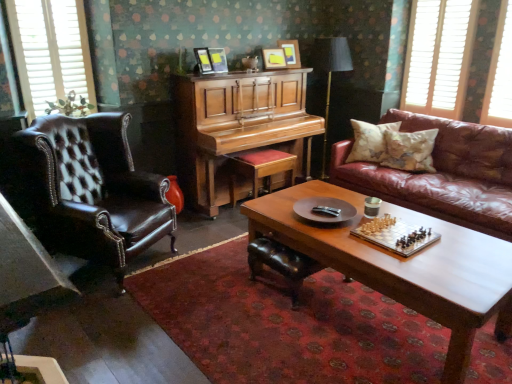
In order to face wooden picture frame at upper center, the fourth picture frame positioned from the left, should I rotate leftwards or rightwards?

To face it directly, rotate right by 4.673 degrees.

Identify the location of white wooden blinds at upper right, which is counted as the 1th window, starting from the right. (500, 74).

Measure the distance between metallic chess set at center and camera.

metallic chess set at center is 2.23 meters from camera.

Where is `wooden picture frame at upper center, the fourth picture frame positioned from the left`? This screenshot has width=512, height=384. wooden picture frame at upper center, the fourth picture frame positioned from the left is located at coordinates (291, 52).

Is polished wood piano at center situated inside matte wooden picture frame at upper center, arranged as the second picture frame when viewed from the left, or outside?

polished wood piano at center is spatially situated outside matte wooden picture frame at upper center, arranged as the second picture frame when viewed from the left.

From the picture: Is polished wood piano at center in contact with matte wooden picture frame at upper center, arranged as the second picture frame when viewed from the left?

polished wood piano at center and matte wooden picture frame at upper center, arranged as the second picture frame when viewed from the left, are clearly separated.

Identify the location of piano in front of the matte wooden picture frame at upper center, arranged as the second picture frame when viewed from the left. This screenshot has height=384, width=512. (238, 127).

Consider the image. Is polished wood piano at center turned away from matte wooden picture frame at upper center, which is counted as the 3th picture frame, starting from the right?

That's not correct — polished wood piano at center is not looking away from matte wooden picture frame at upper center, which is counted as the 3th picture frame, starting from the right.

Would you say matte wooden picture frame at upper center, which appears as the fourth picture frame when viewed from the right, is inside or outside wooden cushioned stool at center?

The correct answer is: outside.

How many degrees apart are the facing directions of matte wooden picture frame at upper center, the 1th picture frame viewed from the left, and wooden cushioned stool at center?

They differ by 164 degrees in their facing directions.

Considering the positions of points (209, 56) and (271, 176), is point (209, 56) closer to camera compared to point (271, 176)?

Yes.

Is matte wooden picture frame at upper center, the 1th picture frame viewed from the left, looking in the opposite direction of wooden cushioned stool at center?

No.

Is white wood window at upper left, which is the first window from left to right, smaller than brown leather couch at right?

Yes, white wood window at upper left, which is the first window from left to right, is smaller than brown leather couch at right.

Find the location of `studio couch below the white wood window at upper left, which is the first window from left to right (from the image's perspective)`. studio couch below the white wood window at upper left, which is the first window from left to right (from the image's perspective) is located at coordinates (443, 174).

From a real-world perspective, is white wood window at upper left, arranged as the third window when viewed from the right, located beneath brown leather couch at right?

No, from a real-world perspective, white wood window at upper left, arranged as the third window when viewed from the right, is not beneath brown leather couch at right.

Measure the distance from metallic chess set at center to white wooden blinds at upper right, acting as the 2th window starting from the left.

metallic chess set at center and white wooden blinds at upper right, acting as the 2th window starting from the left, are 7.25 feet apart from each other.

Which object is positioned more to the right, metallic chess set at center or white wooden blinds at upper right, acting as the 2th window starting from the left?

white wooden blinds at upper right, acting as the 2th window starting from the left, is more to the right.

Is metallic chess set at center next to white wooden blinds at upper right, which ranks as the second window in right-to-left order, and touching it?

metallic chess set at center and white wooden blinds at upper right, which ranks as the second window in right-to-left order, are not in contact.

How many degrees apart are the facing directions of metallic chess set at center and white wooden blinds at upper right, acting as the 2th window starting from the left?

The angle between the facing direction of metallic chess set at center and the facing direction of white wooden blinds at upper right, acting as the 2th window starting from the left, is 1.31 degrees.

Can you confirm if wooden cushioned stool at center is taller than patterned fabric pillow at right, which ranks as the 1th pillow in right-to-left order?

Yes.

Which object is positioned more to the right, wooden cushioned stool at center or patterned fabric pillow at right, marked as the 2th pillow in a left-to-right arrangement?

From the viewer's perspective, patterned fabric pillow at right, marked as the 2th pillow in a left-to-right arrangement, appears more on the right side.

Is wooden cushioned stool at center oriented towards patterned fabric pillow at right, marked as the 2th pillow in a left-to-right arrangement?

No, wooden cushioned stool at center is not aimed at patterned fabric pillow at right, marked as the 2th pillow in a left-to-right arrangement.

Does point (273, 152) appear closer or farther from the camera than point (392, 148)?

Clearly, point (273, 152) is more distant from the camera than point (392, 148).

Is wooden picture frame at upper center, which ranks as the first picture frame in right-to-left order, completely or partially inside patterned fabric pillow at right, which ranks as the 1th pillow in right-to-left order?

Definitely not — wooden picture frame at upper center, which ranks as the first picture frame in right-to-left order, is not inside patterned fabric pillow at right, which ranks as the 1th pillow in right-to-left order.

Are patterned fabric pillow at right, which ranks as the 1th pillow in right-to-left order, and wooden picture frame at upper center, the fourth picture frame positioned from the left, making contact?

patterned fabric pillow at right, which ranks as the 1th pillow in right-to-left order, and wooden picture frame at upper center, the fourth picture frame positioned from the left, are not in contact.

Does point (428, 154) lie in front of point (294, 63)?

Yes, it is in front of point (294, 63).

Which of these two, matte wooden picture frame at upper center, the third picture frame from the left, or white wood window at upper left, arranged as the third window when viewed from the right, is thinner?

Thinner between the two is white wood window at upper left, arranged as the third window when viewed from the right.

Based on the photo, which is closer to the camera, [269,60] or [65,72]?

The point [65,72] is in front.

Choose the correct answer: Is matte wooden picture frame at upper center, the third picture frame from the left, inside white wood window at upper left, arranged as the third window when viewed from the right, or outside it?

matte wooden picture frame at upper center, the third picture frame from the left, cannot be found inside white wood window at upper left, arranged as the third window when viewed from the right.

This screenshot has height=384, width=512. I want to click on the 3rd picture frame to the right of the white wood window at upper left, arranged as the third window when viewed from the right, starting your count from the anchor, so click(x=274, y=58).

Find the location of a particular element. The image size is (512, 384). piano in front of the matte wooden picture frame at upper center, arranged as the second picture frame when viewed from the left is located at coordinates (238, 127).

The image size is (512, 384). I want to click on stool that is below the matte wooden picture frame at upper center, the 1th picture frame viewed from the left (from the image's perspective), so click(259, 168).

Estimate the real-world distances between objects in this image. Which object is further from matte wooden picture frame at upper center, marked as the 2th picture frame in a right-to-left arrangement, matte black table lamp at center or wooden polished coffee table at center?

Based on the image, wooden polished coffee table at center appears to be further to matte wooden picture frame at upper center, marked as the 2th picture frame in a right-to-left arrangement.

Considering their positions, is metallic chess set at center positioned closer to patterned fabric pillow at right, marked as the 2th pillow in a left-to-right arrangement, than white wooden blinds at upper right, which is counted as the 1th window, starting from the right?

The object closer to patterned fabric pillow at right, marked as the 2th pillow in a left-to-right arrangement, is white wooden blinds at upper right, which is counted as the 1th window, starting from the right.

From the image, which object appears to be farther from wooden picture frame at upper center, the fourth picture frame positioned from the left, polished wood piano at center or white wooden blinds at upper right, placed as the third window when sorted from left to right?

white wooden blinds at upper right, placed as the third window when sorted from left to right.

Based on their spatial positions, is matte black table lamp at center or white wooden blinds at upper right, placed as the third window when sorted from left to right, further from leather footrest at center?

white wooden blinds at upper right, placed as the third window when sorted from left to right, is further to leather footrest at center.

Looking at the image, which one is located further to matte wooden picture frame at upper center, marked as the 2th picture frame in a right-to-left arrangement, leather footrest at center or metallic chess set at center?

metallic chess set at center lies further to matte wooden picture frame at upper center, marked as the 2th picture frame in a right-to-left arrangement, than the other object.

Based on their spatial positions, is wooden polished coffee table at center or white wood window at upper left, arranged as the third window when viewed from the right, further from white wooden blinds at upper right, which ranks as the second window in right-to-left order?

Among the two, white wood window at upper left, arranged as the third window when viewed from the right, is located further to white wooden blinds at upper right, which ranks as the second window in right-to-left order.

When comparing their distances from polished wood piano at center, does white wooden blinds at upper right, acting as the 2th window starting from the left, or patterned fabric pillow at right, marked as the 2th pillow in a left-to-right arrangement, seem further?

white wooden blinds at upper right, acting as the 2th window starting from the left, is further to polished wood piano at center.

Looking at the image, which one is located further to white wooden blinds at upper right, acting as the 2th window starting from the left, wooden picture frame at upper center, which ranks as the first picture frame in right-to-left order, or patterned fabric pillow at right, which ranks as the 1th pillow in right-to-left order?

Among the two, wooden picture frame at upper center, which ranks as the first picture frame in right-to-left order, is located further to white wooden blinds at upper right, acting as the 2th window starting from the left.

I want to click on footrest between brown leather wingback chair at left and wooden cushioned stool at center in the front-back direction, so pyautogui.click(x=281, y=263).

The width and height of the screenshot is (512, 384). What are the coordinates of `chair between white wood window at upper left, which is the first window from left to right, and matte wooden picture frame at upper center, marked as the 2th picture frame in a right-to-left arrangement, from left to right` in the screenshot? It's located at (94, 189).

What are the coordinates of `footrest between brown leather wingback chair at left and wooden polished coffee table at center` in the screenshot? It's located at (281, 263).

At what (x,y) coordinates should I click in order to perform the action: click on the footrest located between metallic chess set at center and wooden picture frame at upper center, which ranks as the first picture frame in right-to-left order, in the depth direction. Please return your answer as a coordinate pair (x, y). The height and width of the screenshot is (384, 512). Looking at the image, I should click on (281, 263).